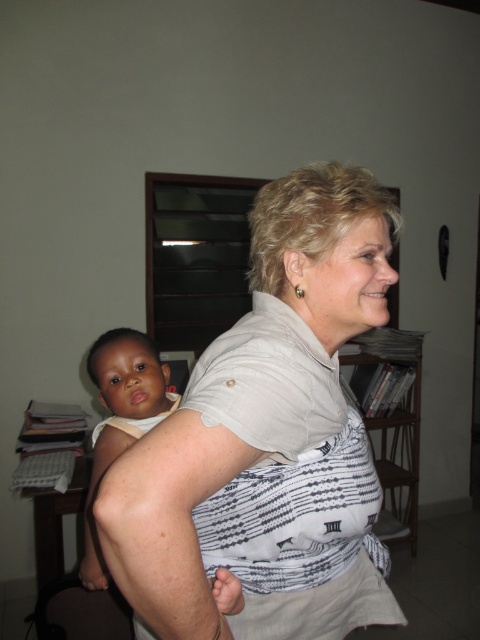
Can you confirm if white textured shirt at center is taller than light brown skin baby at center?

Correct, white textured shirt at center is much taller as light brown skin baby at center.

Does white textured shirt at center appear on the left side of light brown skin baby at center?

No, white textured shirt at center is not to the left of light brown skin baby at center.

Does point (363, 624) come behind point (156, 360)?

That is False.

I want to click on white textured shirt at center, so click(252, 397).